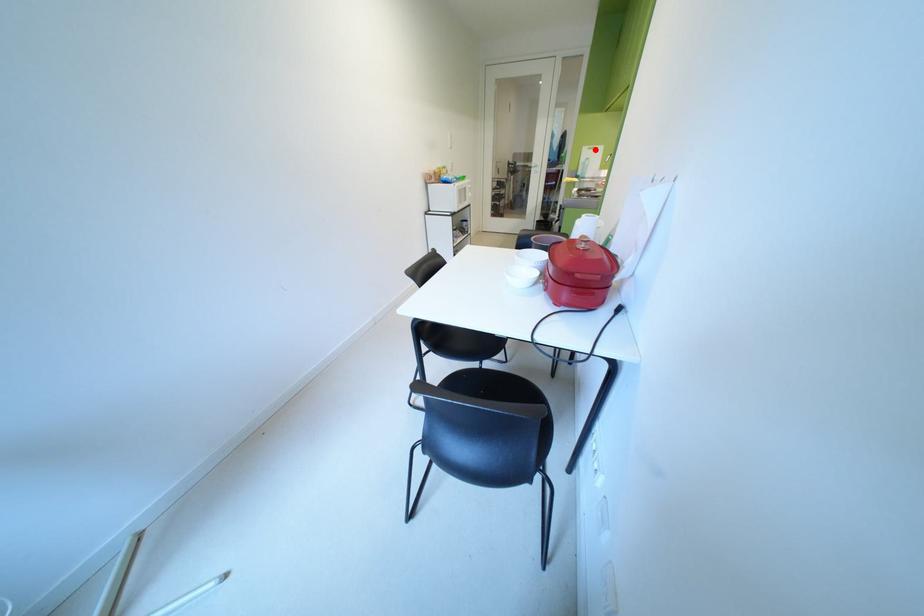
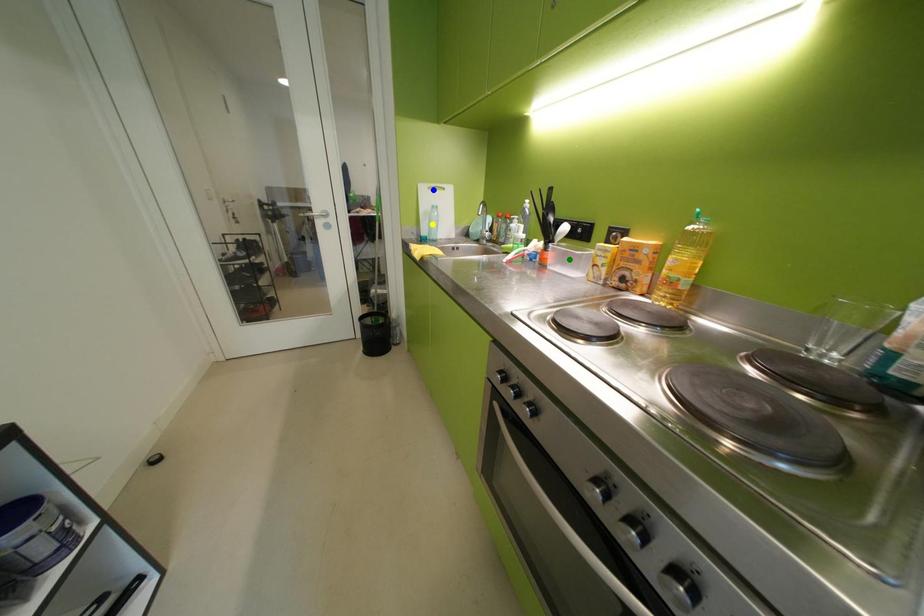
Question: I am providing you with two images of the same scene from different viewpoints. A red point is marked on the first image. You are given multiple points on the second image. Which mark in image 2 goes with the point in image 1?

Choices:
 (A) blue point
 (B) yellow point
 (C) green point

Answer: (A)